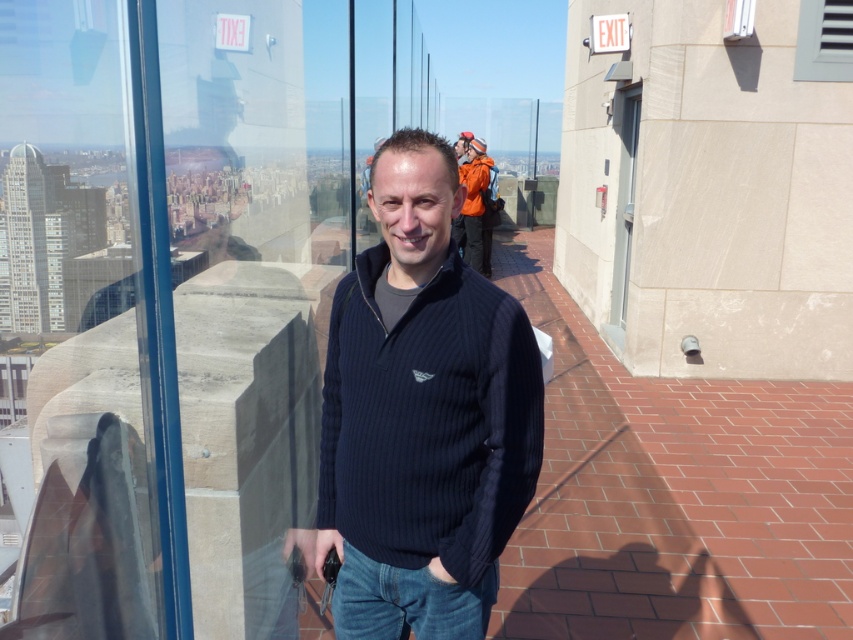
Question: Is black ribbed sweater at center below gray matte vent at upper right?

Choices:
 (A) no
 (B) yes

Answer: (B)

Question: Which is farther from the black ribbed sweater at center?

Choices:
 (A) orange fabric jacket at upper center
 (B) clear glass window at upper right

Answer: (A)

Question: Which point appears closest to the camera in this image?

Choices:
 (A) (402, 488)
 (B) (805, 48)

Answer: (A)

Question: Which of the following is the farthest from the observer?

Choices:
 (A) (329, 320)
 (B) (465, 163)
 (C) (740, 36)

Answer: (B)

Question: Is black ribbed sweater at center above clear glass window at upper right?

Choices:
 (A) yes
 (B) no

Answer: (B)

Question: Is the position of black ribbed sweater at center less distant than that of clear glass window at upper right?

Choices:
 (A) yes
 (B) no

Answer: (A)